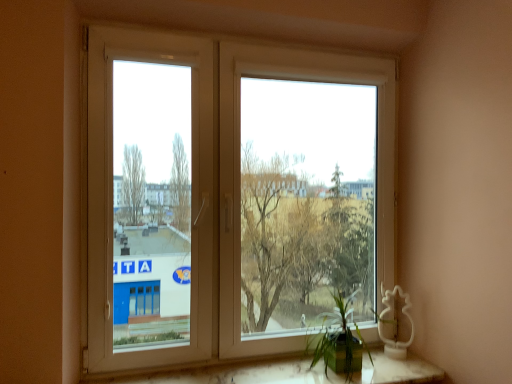
Measure the distance between point [311,346] and camera.

The distance of point [311,346] from camera is 6.03 feet.

I want to click on white marble window sill at lower center, so click(229, 373).

Looking at this image, could you tell me if white plastic window at center is turned towards white plastic window at left?

No, white plastic window at center is not facing towards white plastic window at left.

From a real-world perspective, is white plastic window at center over white plastic window at left?

Actually, white plastic window at center is physically below white plastic window at left in the real world.

From the image's perspective, between white plastic window at center and white plastic window at left, who is located below?

white plastic window at center appears lower in the image.

I want to click on window frame on the left of the green matte plant at lower right, so click(x=149, y=199).

Does green matte plant at lower right have a lesser height compared to white plastic window at left?

Yes.

In terms of size, does green matte plant at lower right appear bigger or smaller than white plastic window at left?

Considering their sizes, green matte plant at lower right takes up less space than white plastic window at left.

Consider the image. Is green matte plant at lower right to the right of white plastic window at left from the viewer's perspective?

Indeed, green matte plant at lower right is positioned on the right side of white plastic window at left.

I want to click on window sill that is on the right side of white plastic window at left, so click(x=229, y=373).

Is white marble window sill at lower center at the right side of white plastic window at left?

Yes.

From their relative heights in the image, would you say white marble window sill at lower center is taller or shorter than white plastic window at left?

In the image, white marble window sill at lower center appears to be shorter than white plastic window at left.

Is white marble window sill at lower center not inside white plastic window at left?

Yes, white marble window sill at lower center is outside of white plastic window at left.

From a real-world perspective, is white plastic window at center beneath green matte plant at lower right?

No, from a real-world perspective, white plastic window at center is not beneath green matte plant at lower right.

Is point (105, 55) in front of point (348, 314)?

Yes.

Which is more to the left, white plastic window at center or green matte plant at lower right?

white plastic window at center is more to the left.

Could you tell me if white plastic window at center is facing green matte plant at lower right?

Yes, white plastic window at center is oriented towards green matte plant at lower right.

Is white plastic window at center outside of white marble window sill at lower center?

Indeed, white plastic window at center is completely outside white marble window sill at lower center.

In the scene shown: Which is more distant, (251, 242) or (379, 366)?

Positioned behind is point (251, 242).

Is white plastic window at center next to white marble window sill at lower center?

No, white plastic window at center is not with white marble window sill at lower center.

From a real-world perspective, is white plastic window at center physically located above or below white marble window sill at lower center?

white plastic window at center is above white marble window sill at lower center.

Between green matte plant at lower right and white marble window sill at lower center, which one has larger width?

With larger width is white marble window sill at lower center.

Which object is positioned more to the left, green matte plant at lower right or white marble window sill at lower center?

white marble window sill at lower center is more to the left.

Is green matte plant at lower right oriented away from white marble window sill at lower center?

green matte plant at lower right does not have its back to white marble window sill at lower center.

Which is less distant, (184, 233) or (201, 289)?

Point (184, 233).

From the image's perspective, which one is positioned lower, white plastic window at left or white plastic window at center?

white plastic window at center appears lower in the image.

Which is correct: white plastic window at left is inside white plastic window at center, or outside of it?

white plastic window at left is outside white plastic window at center.

Based on their positions, is white plastic window at left located to the left or right of white plastic window at center?

Clearly, white plastic window at left is on the left of white plastic window at center in the image.

Locate an element on the screen. window frame located in front of the white plastic window at center is located at coordinates (149, 199).

This screenshot has width=512, height=384. Find the location of `window frame above the green matte plant at lower right (from the image's perspective)`. window frame above the green matte plant at lower right (from the image's perspective) is located at coordinates 149,199.

When comparing their distances from white marble window sill at lower center, does green matte plant at lower right or white plastic window at left seem closer?

Based on the image, green matte plant at lower right appears to be nearer to white marble window sill at lower center.

Estimate the real-world distances between objects in this image. Which object is further from white marble window sill at lower center, white plastic window at center or green matte plant at lower right?

The object further to white marble window sill at lower center is white plastic window at center.

Which object lies nearer to the anchor point green matte plant at lower right, white plastic window at left or white marble window sill at lower center?

white marble window sill at lower center.

When comparing their distances from white plastic window at center, does white marble window sill at lower center or green matte plant at lower right seem further?

white marble window sill at lower center lies further to white plastic window at center than the other object.

Looking at the image, which one is located further to white marble window sill at lower center, green matte plant at lower right or white plastic window at center?

Among the two, white plastic window at center is located further to white marble window sill at lower center.

When comparing their distances from white plastic window at left, does white plastic window at center or green matte plant at lower right seem closer?

Based on the image, green matte plant at lower right appears to be nearer to white plastic window at left.

Considering their positions, is white plastic window at left positioned closer to green matte plant at lower right than white plastic window at center?

white plastic window at left.

Looking at the image, which one is located closer to white plastic window at center, white marble window sill at lower center or white plastic window at left?

white plastic window at left lies closer to white plastic window at center than the other object.

You are a GUI agent. You are given a task and a screenshot of the screen. Output one action in this format:
    pyautogui.click(x=<x>, y=<y>)
    Task: Click on the window situated between white plastic window at left and green matte plant at lower right from left to right
    Image resolution: width=512 pixels, height=384 pixels.
    Given the screenshot: What is the action you would take?
    pyautogui.click(x=231, y=196)

Find the location of a particular element. window sill between white plastic window at left and green matte plant at lower right from left to right is located at coordinates (229, 373).

Locate an element on the screen. The image size is (512, 384). houseplant between white plastic window at center and white marble window sill at lower center in the vertical direction is located at coordinates [x=338, y=340].

What are the coordinates of `window between white plastic window at left and white marble window sill at lower center in the vertical direction` in the screenshot? It's located at (231, 196).